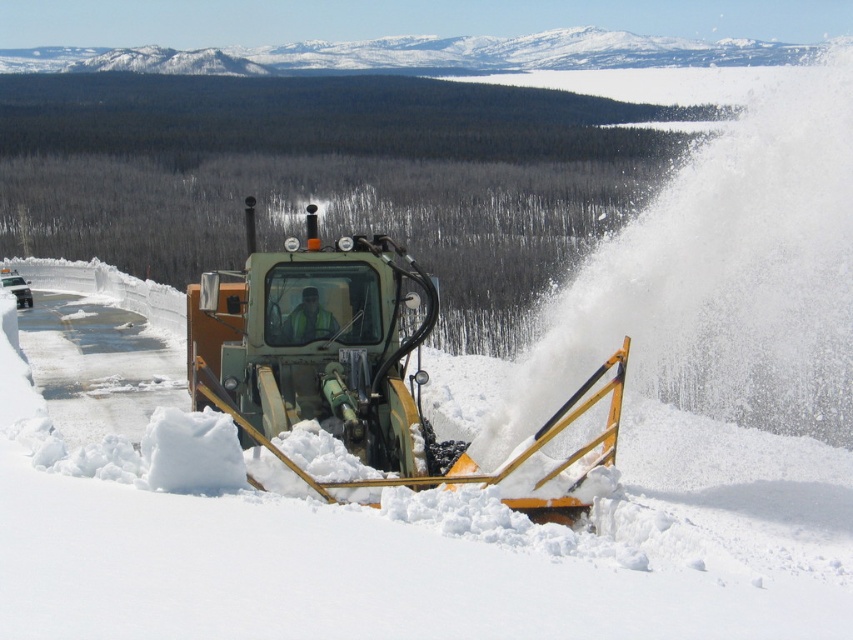
Does green metallic snowplow at center have a greater width compared to reflective safety vest at center?

Yes.

Between point (202, 360) and point (305, 301), which one is positioned behind?

The point (305, 301) is behind.

Image resolution: width=853 pixels, height=640 pixels. I want to click on green metallic snowplow at center, so click(346, 362).

Can you confirm if yellow metallic snowplow at center is taller than green metallic snowplow at center?

No, yellow metallic snowplow at center is not taller than green metallic snowplow at center.

Is yellow metallic snowplow at center below green metallic snowplow at center?

Yes.

Between point (648, 467) and point (219, 326), which one is positioned behind?

The point (219, 326) is behind.

At what (x,y) coordinates should I click in order to perform the action: click on yellow metallic snowplow at center. Please return your answer as a coordinate pair (x, y). Image resolution: width=853 pixels, height=640 pixels. Looking at the image, I should click on (440, 556).

Where is `yellow metallic snowplow at center`? yellow metallic snowplow at center is located at coordinates (440, 556).

Does yellow metallic snowplow at center have a lesser width compared to reflective safety vest at center?

No.

Describe the element at coordinates (440, 556) in the screenshot. I see `yellow metallic snowplow at center` at that location.

Locate an element on the screen. This screenshot has height=640, width=853. yellow metallic snowplow at center is located at coordinates (440, 556).